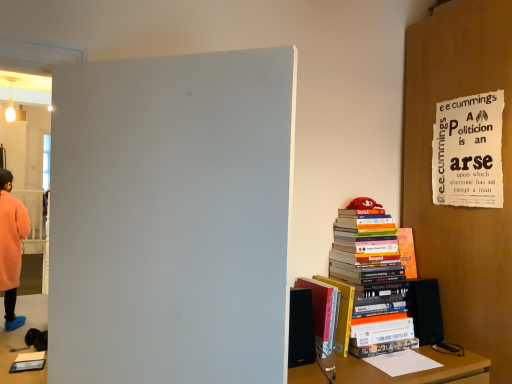
Question: Considering the positions of fluffy pink coat at left and ripped paper poster at upper right in the image, is fluffy pink coat at left bigger or smaller than ripped paper poster at upper right?

Choices:
 (A) small
 (B) big

Answer: (B)

Question: From a real-world perspective, is fluffy pink coat at left positioned above or below ripped paper poster at upper right?

Choices:
 (A) below
 (B) above

Answer: (A)

Question: Estimate the real-world distances between objects in this image. Which object is closer to the hardcover books at right, the 1th book from the right?

Choices:
 (A) ripped paper poster at upper right
 (B) hardcover book at right, placed as the first book when sorted from left to right
 (C) fluffy pink coat at left

Answer: (B)

Question: Which object is positioned farthest from the hardcover books at right, which is the second book from left to right?

Choices:
 (A) ripped paper poster at upper right
 (B) fluffy pink coat at left
 (C) hardcover book at right, which appears as the 2th book when viewed from the right

Answer: (B)